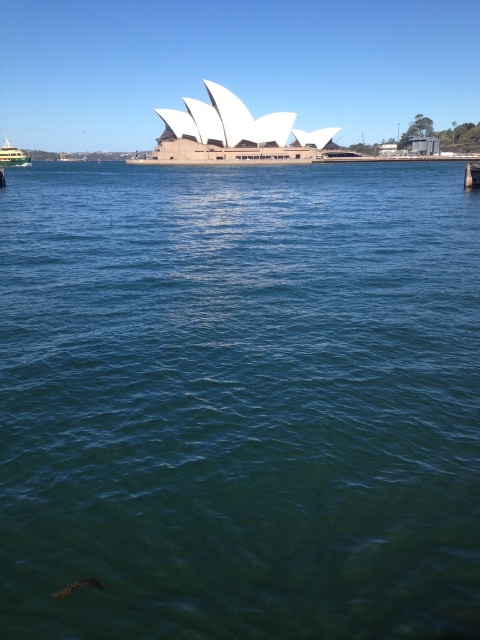
Who is higher up, green water at center or green metallic ferry at left?

Positioned higher is green metallic ferry at left.

Measure the distance between green water at center and green metallic ferry at left.

green water at center and green metallic ferry at left are 110.90 meters apart from each other.

Who is more distant from viewer, (116, 184) or (9, 145)?

The point (9, 145) is more distant.

This screenshot has height=640, width=480. Identify the location of green water at center. (240, 401).